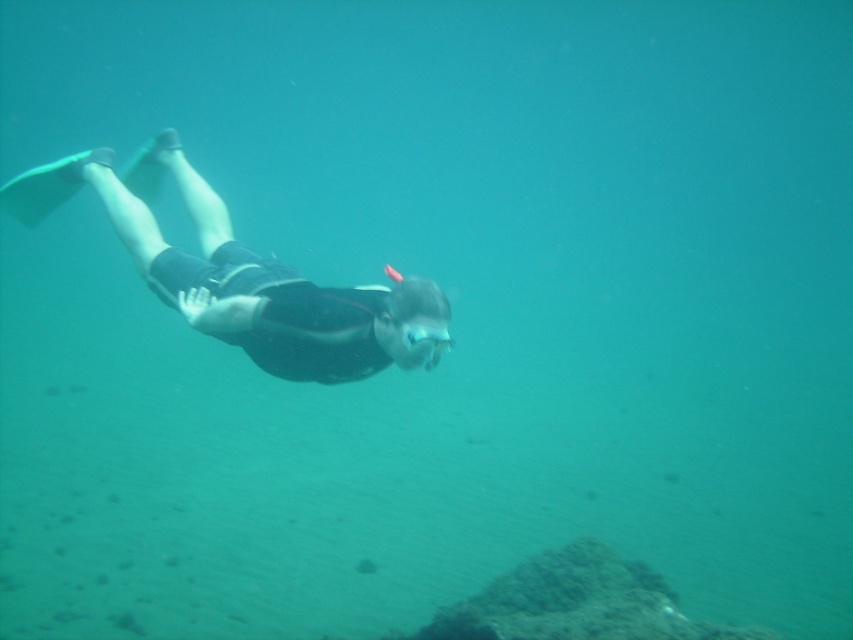
Question: From the image, what is the correct spatial relationship of black matte wetsuit at center in relation to clear plastic goggles at center?

Choices:
 (A) above
 (B) below

Answer: (A)

Question: From the image, what is the correct spatial relationship of black matte wetsuit at center in relation to clear plastic goggles at center?

Choices:
 (A) above
 (B) below

Answer: (A)

Question: Which of the following is the closest to the observer?

Choices:
 (A) black matte wetsuit at center
 (B) clear plastic goggles at center

Answer: (B)

Question: Does black matte wetsuit at center appear over clear plastic goggles at center?

Choices:
 (A) no
 (B) yes

Answer: (B)

Question: Which object appears closest to the camera in this image?

Choices:
 (A) black matte wetsuit at center
 (B) clear plastic goggles at center

Answer: (B)